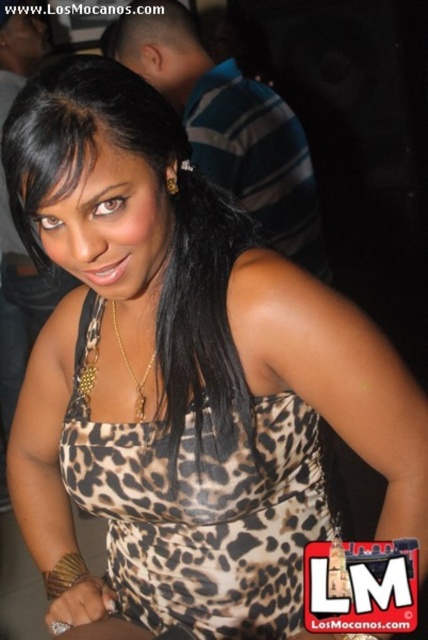
Question: Which point is closer to the camera?

Choices:
 (A) leopard print fabric dress at center
 (B) gold chain at center

Answer: (A)

Question: Where is leopard print fabric dress at center located in relation to leopard print dress at center in the image?

Choices:
 (A) below
 (B) above

Answer: (A)

Question: Which object is closer to the camera taking this photo?

Choices:
 (A) leopard print fabric dress at center
 (B) leopard print dress at center
 (C) gold chain at center

Answer: (B)

Question: Which of the following is the closest to the observer?

Choices:
 (A) gold chain at center
 (B) leopard print fabric dress at center
 (C) leopard print dress at center

Answer: (C)

Question: Is leopard print dress at center positioned at the back of gold chain at center?

Choices:
 (A) no
 (B) yes

Answer: (A)

Question: Can you confirm if leopard print dress at center is positioned to the right of gold chain at center?

Choices:
 (A) yes
 (B) no

Answer: (A)